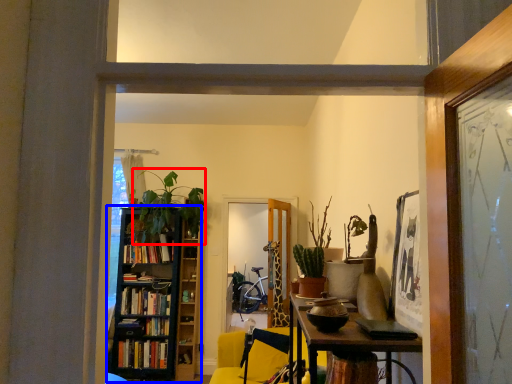
Question: Which object appears closest to the camera in this image, plant (highlighted by a red box) or bookcase (highlighted by a blue box)?

Choices:
 (A) plant
 (B) bookcase

Answer: (A)